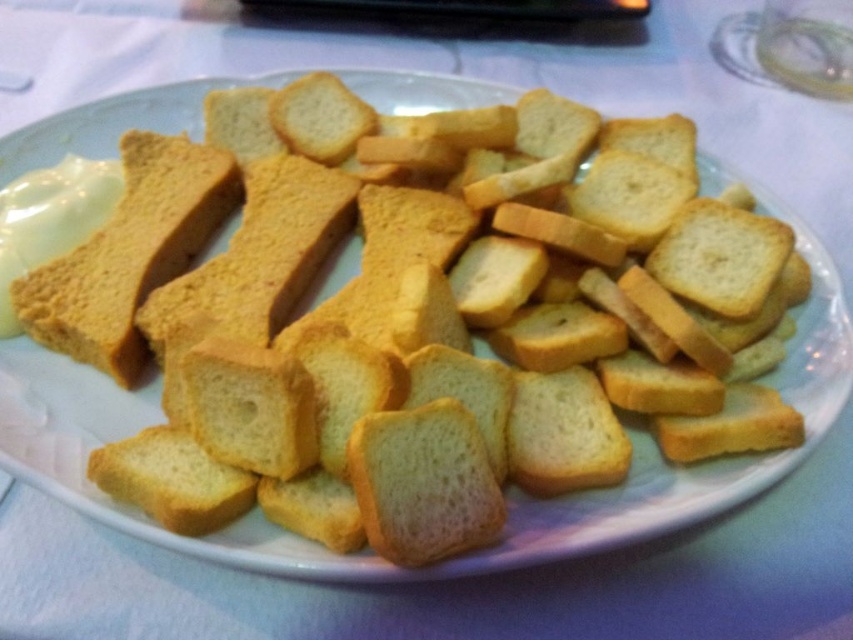
Does yellow crumbly bread at upper left appear under golden crispy crouton at center?

No, yellow crumbly bread at upper left is not below golden crispy crouton at center.

Which of these two, yellow crumbly bread at upper left or golden crispy crouton at center, stands taller?

yellow crumbly bread at upper left is taller.

Does point (106, 252) come farther from viewer compared to point (456, 545)?

Yes, point (106, 252) is farther from viewer.

Find the location of a particular element. The width and height of the screenshot is (853, 640). yellow crumbly bread at upper left is located at coordinates (131, 253).